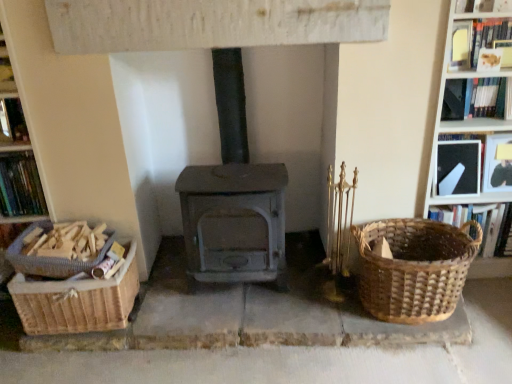
The height and width of the screenshot is (384, 512). I want to click on empty space that is in between woven brown basket at lower left and brown woven basket at right, the second basket viewed from the left, so click(236, 304).